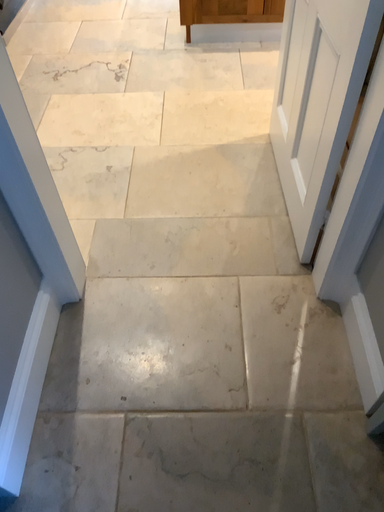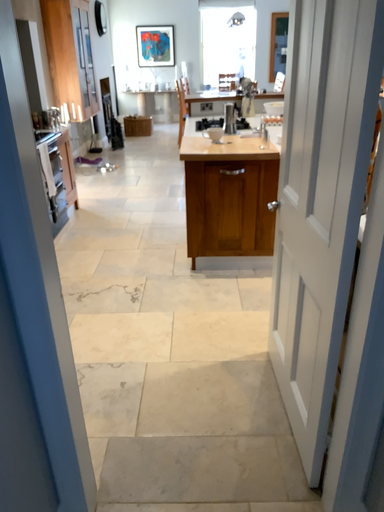
Question: How did the camera likely rotate when shooting the video?

Choices:
 (A) rotated upward
 (B) rotated downward

Answer: (A)